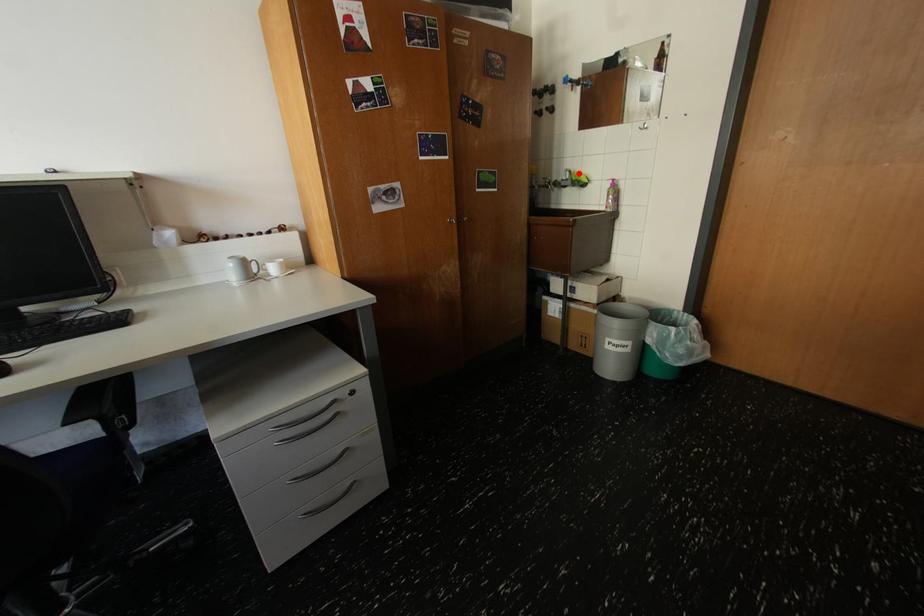
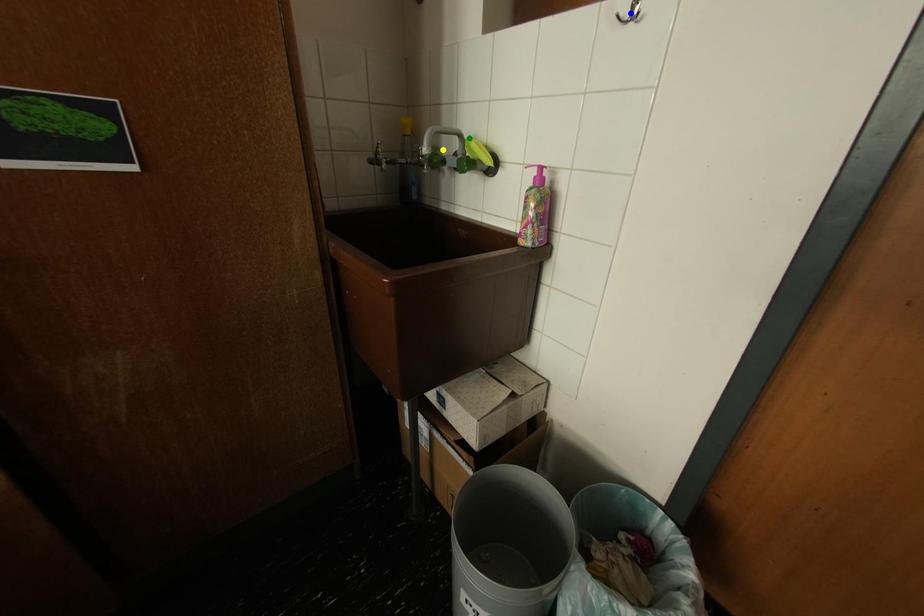
Question: I am providing you with two images of the same scene from different viewpoints. A red point is marked on the first image. You are given multiple points on the second image. Which mark in image 2 goes with the point in image 1?

Choices:
 (A) yellow point
 (B) blue point
 (C) green point

Answer: (C)